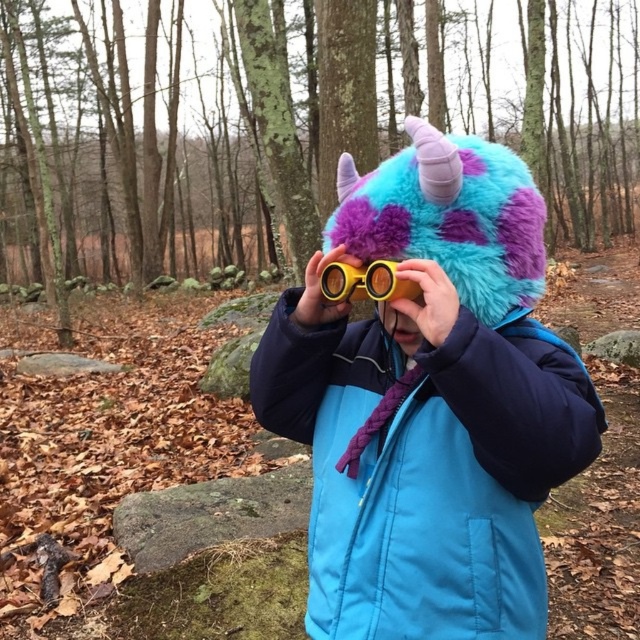
You are a hiker trying to decide whether to wear your blue quilted jacket at center over your yellow plastic goggles at center. Based on their sizes, will the jacket cover the goggles when worn?

The blue quilted jacket at center is taller than yellow plastic goggles at center, so when worn, the jacket will cover the goggles.

You are standing in a forest and see the blue quilted jacket at center. If you want to reach into your pocket to grab your phone, which is in your right pocket, will you need to move the jacket?

The blue quilted jacket at center is 28.66 inches from viewer, so you would need to move closer to reach into your pocket without obstruction.

You are trying to determine which object is nearer to you in the image. You see a blue quilted jacket at center and a yellow plastic goggles at center. Which one is closer?

The blue quilted jacket at center is closer to the viewer than the yellow plastic goggles at center.